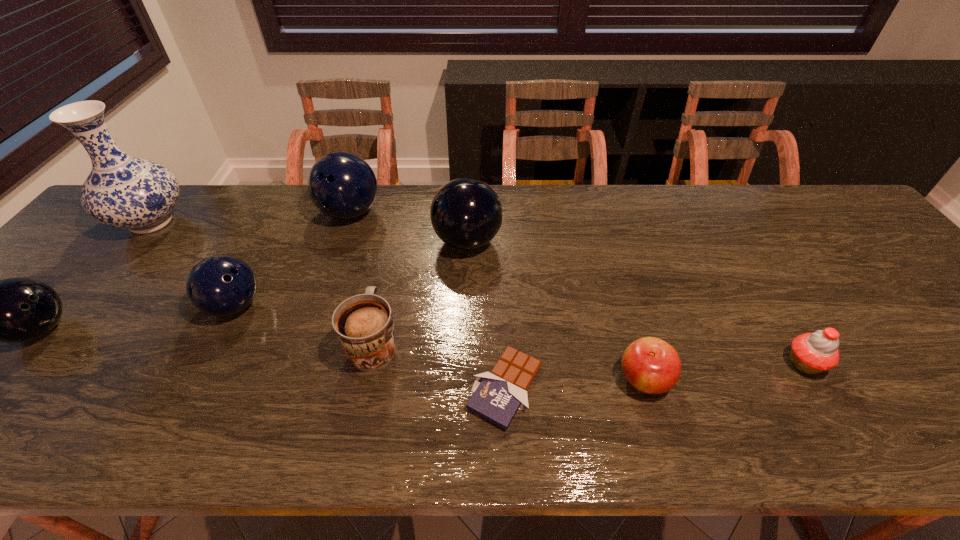
In the image, there is a desktop. Where is `vacant space at the far left corner`? vacant space at the far left corner is located at coordinates (92, 230).

I want to click on free location at the far right corner of the desktop, so click(818, 195).

Where is `free space that is in between the right black bowling ball and the shortest object`? free space that is in between the right black bowling ball and the shortest object is located at coordinates (487, 314).

Image resolution: width=960 pixels, height=540 pixels. What are the coordinates of `vacant space that's between the shortest object and the right black bowling ball` in the screenshot? It's located at (487, 314).

Where is `vacant space in between the rightmost object and the apple`? The height and width of the screenshot is (540, 960). vacant space in between the rightmost object and the apple is located at coordinates (724, 372).

Where is `free space between the red cupcake and the apple`? free space between the red cupcake and the apple is located at coordinates point(724,372).

This screenshot has height=540, width=960. I want to click on free space between the vase and the shortest object, so click(x=328, y=305).

Locate an element on the screen. The height and width of the screenshot is (540, 960). object that stands as the eighth closest to the vase is located at coordinates (812, 353).

Locate which object ranks seventh in proximity to the blue vase. Please provide its 2D coordinates. Your answer should be formatted as a tuple, i.e. [(x, y)], where the tuple contains the x and y coordinates of a point satisfying the conditions above.

[(651, 365)]

Select which bowling ball appears as the second closest to the right blue bowling ball. Please provide its 2D coordinates. Your answer should be formatted as a tuple, i.e. [(x, y)], where the tuple contains the x and y coordinates of a point satisfying the conditions above.

[(221, 285)]